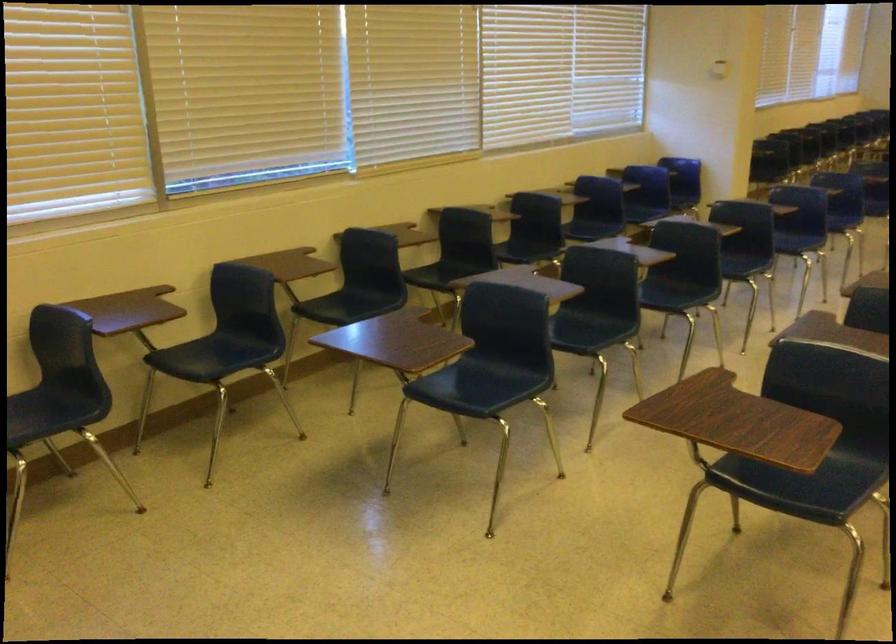
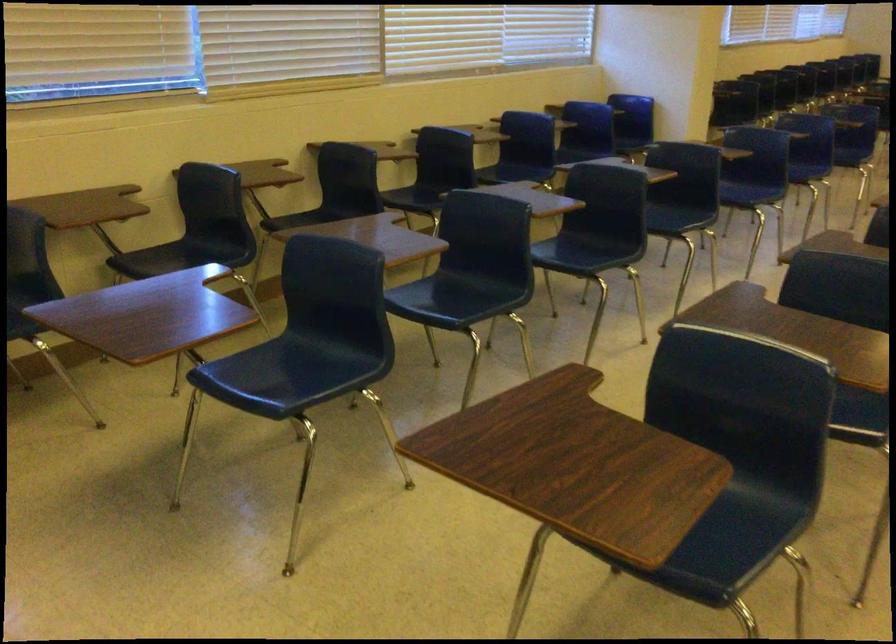
In the second image, find the point that corresponds to (x=467, y=384) in the first image.

(283, 375)